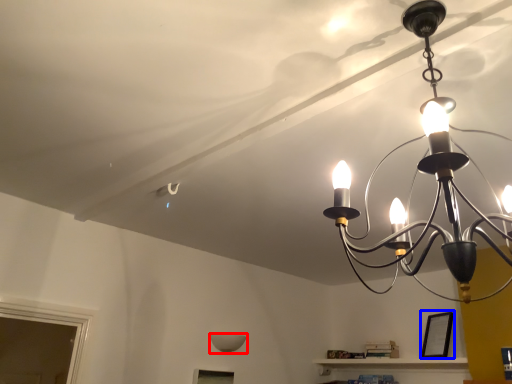
Question: Which point is further to the camera, lamp (highlighted by a red box) or picture frame (highlighted by a blue box)?

Choices:
 (A) lamp
 (B) picture frame

Answer: (A)